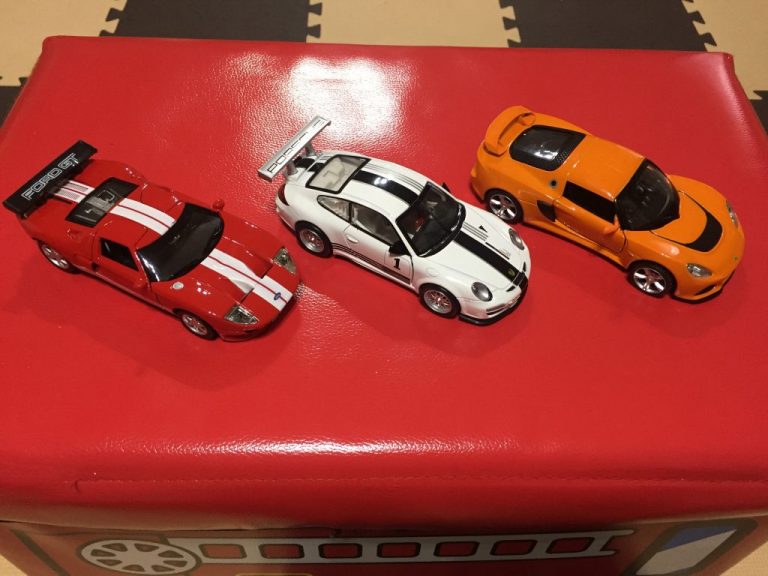
Identify the location of cushioned table top. (398, 408).